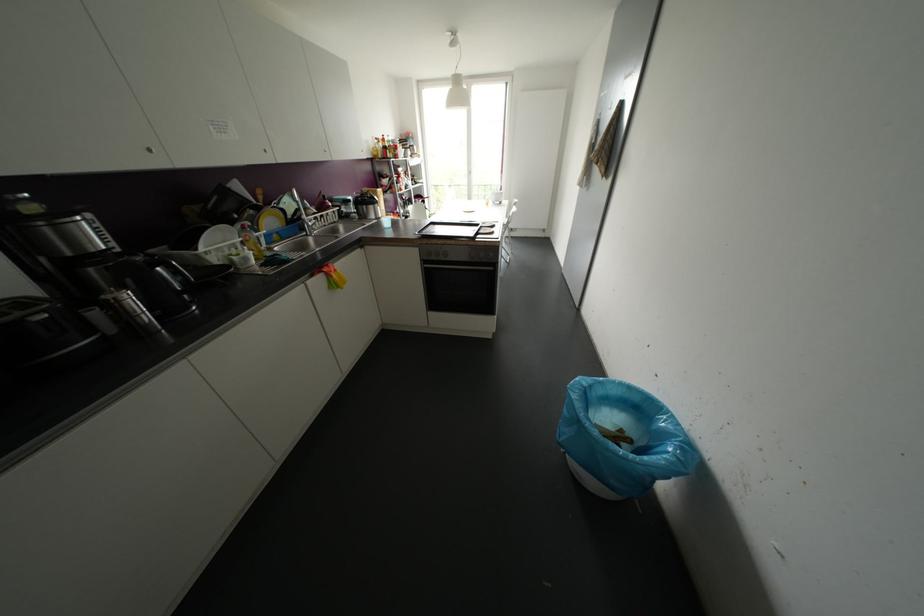
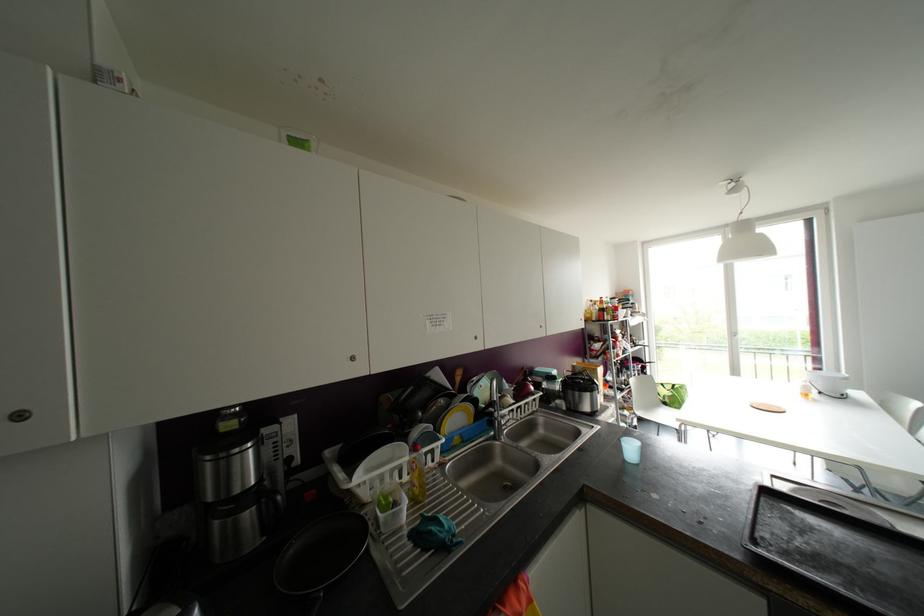
Where in the second image is the point corresponding to point 149,150 from the first image?

(351, 358)